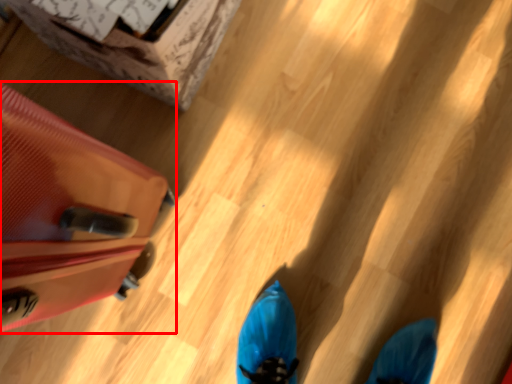
Question: In this image, where is luggage (annotated by the red box) located relative to cardboard box?

Choices:
 (A) left
 (B) right

Answer: (A)